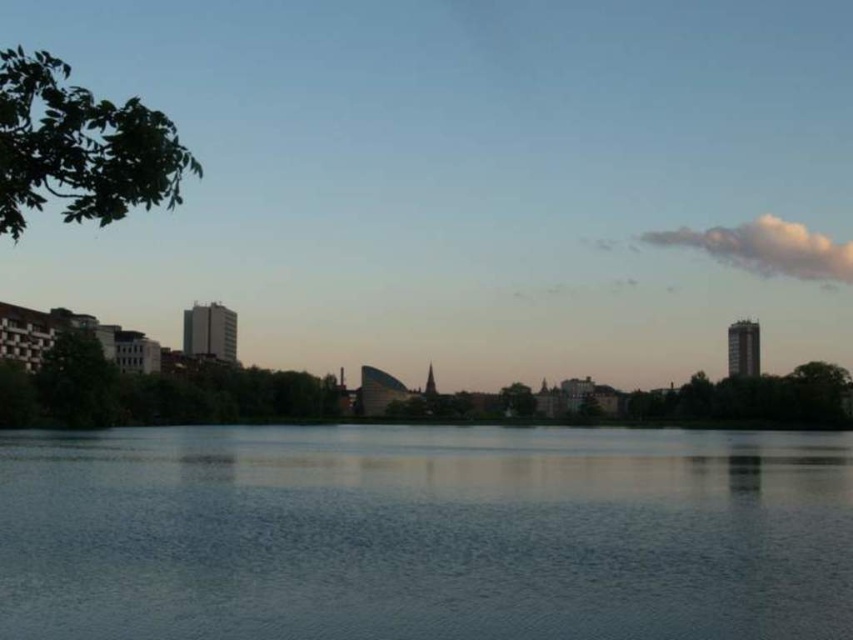
Can you confirm if smooth water at center is wider than green leafy branch at upper left?

Incorrect, smooth water at center's width does not surpass green leafy branch at upper left's.

Which is more to the right, smooth water at center or green leafy branch at upper left?

smooth water at center is more to the right.

Is point (753, 508) farther from camera compared to point (154, 172)?

Yes, it is behind point (154, 172).

At what (x,y) coordinates should I click in order to perform the action: click on smooth water at center. Please return your answer as a coordinate pair (x, y). The image size is (853, 640). Looking at the image, I should click on (424, 532).

Can you confirm if green matte tree at left is positioned below green leafy tree at center?

Actually, green matte tree at left is above green leafy tree at center.

In the scene shown: Who is more forward, (88, 419) or (523, 397)?

Point (88, 419) is more forward.

Find the location of a particular element. green matte tree at left is located at coordinates (76, 381).

Can you confirm if green leafy branch at upper left is shorter than green leafy tree at right?

No, green leafy branch at upper left is not shorter than green leafy tree at right.

Is point (93, 164) closer to camera compared to point (828, 417)?

Yes, point (93, 164) is in front of point (828, 417).

The image size is (853, 640). In order to click on green leafy branch at upper left in this screenshot , I will do `click(79, 147)`.